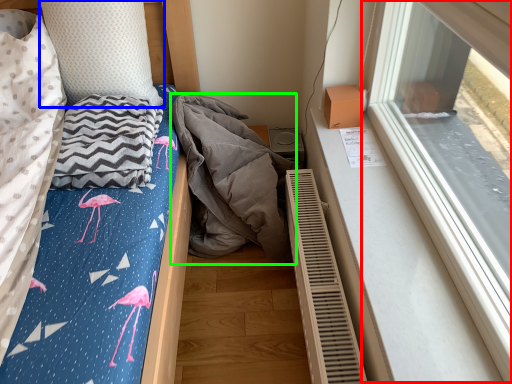
Question: Which object is the farthest from window (highlighted by a red box)? Choose among these: pillow (highlighted by a blue box) or material (highlighted by a green box).

Choices:
 (A) pillow
 (B) material

Answer: (A)